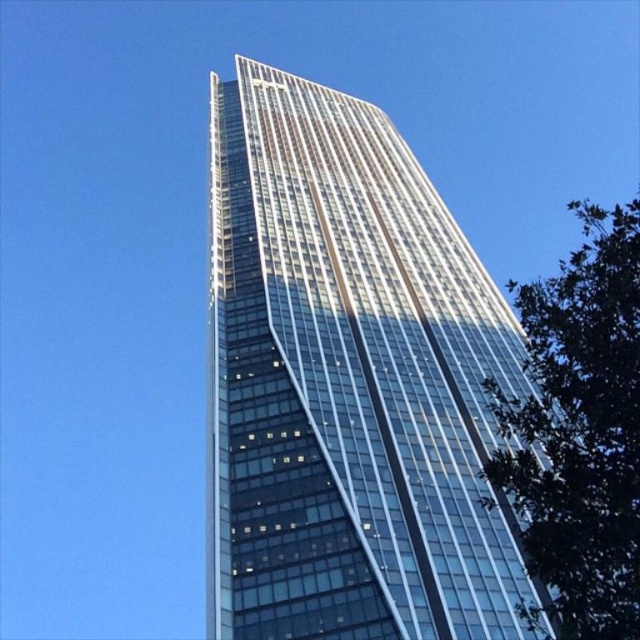
You are standing in front of the modern skyscraper and want to take a photo that includes both the transparent glass tower at center and the green leafy tree at right. Considering their heights, which object will appear larger in the photo?

The transparent glass tower at center is much taller than the green leafy tree at right, so it will appear larger in the photo.

You are standing at the base of the transparent glass tower at center. If you walk straight towards the top of the building, how far will you have to walk to reach the entrance?

The transparent glass tower at center is 66.14 feet away from the viewer, so you would need to walk approximately 66.14 feet to reach the entrance.